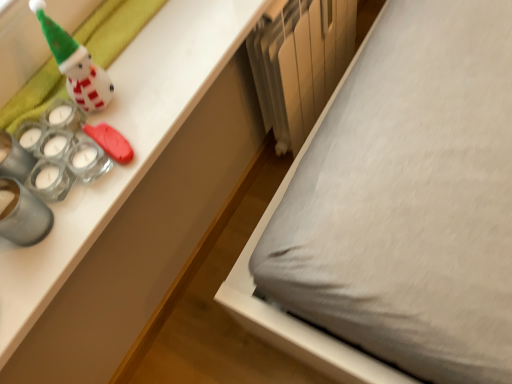
Question: Considering the relative positions of metallic silver radiator at lower center and white glossy desk at upper left in the image provided, is metallic silver radiator at lower center behind white glossy desk at upper left?

Choices:
 (A) no
 (B) yes

Answer: (B)

Question: Considering the relative sizes of metallic silver radiator at lower center and white glossy desk at upper left in the image provided, is metallic silver radiator at lower center smaller than white glossy desk at upper left?

Choices:
 (A) yes
 (B) no

Answer: (B)

Question: From the image's perspective, is metallic silver radiator at lower center beneath white glossy desk at upper left?

Choices:
 (A) no
 (B) yes

Answer: (A)

Question: Can you confirm if metallic silver radiator at lower center is bigger than white glossy desk at upper left?

Choices:
 (A) no
 (B) yes

Answer: (B)

Question: Does metallic silver radiator at lower center have a lesser width compared to white glossy desk at upper left?

Choices:
 (A) no
 (B) yes

Answer: (B)

Question: Based on their positions, is white glossy snowman at upper left located to the left or right of white glossy desk at upper left?

Choices:
 (A) left
 (B) right

Answer: (A)

Question: Is point (88, 94) positioned closer to the camera than point (192, 225)?

Choices:
 (A) farther
 (B) closer

Answer: (B)

Question: From the image's perspective, is white glossy snowman at upper left above or below white glossy desk at upper left?

Choices:
 (A) below
 (B) above

Answer: (B)

Question: Is white glossy snowman at upper left inside the boundaries of white glossy desk at upper left, or outside?

Choices:
 (A) outside
 (B) inside

Answer: (A)

Question: From their relative heights in the image, would you say metallic silver radiator at lower center is taller or shorter than white glossy snowman at upper left?

Choices:
 (A) short
 (B) tall

Answer: (B)

Question: Considering the positions of metallic silver radiator at lower center and white glossy snowman at upper left in the image, is metallic silver radiator at lower center wider or thinner than white glossy snowman at upper left?

Choices:
 (A) thin
 (B) wide

Answer: (B)

Question: From a real-world perspective, is metallic silver radiator at lower center above or below white glossy snowman at upper left?

Choices:
 (A) above
 (B) below

Answer: (B)

Question: Considering the positions of point (294, 77) and point (51, 24), is point (294, 77) closer or farther from the camera than point (51, 24)?

Choices:
 (A) closer
 (B) farther

Answer: (B)

Question: From the image's perspective, is white glossy desk at upper left positioned above or below white glossy snowman at upper left?

Choices:
 (A) below
 (B) above

Answer: (A)

Question: From a real-world perspective, relative to white glossy snowman at upper left, is white glossy desk at upper left vertically above or below?

Choices:
 (A) above
 (B) below

Answer: (B)